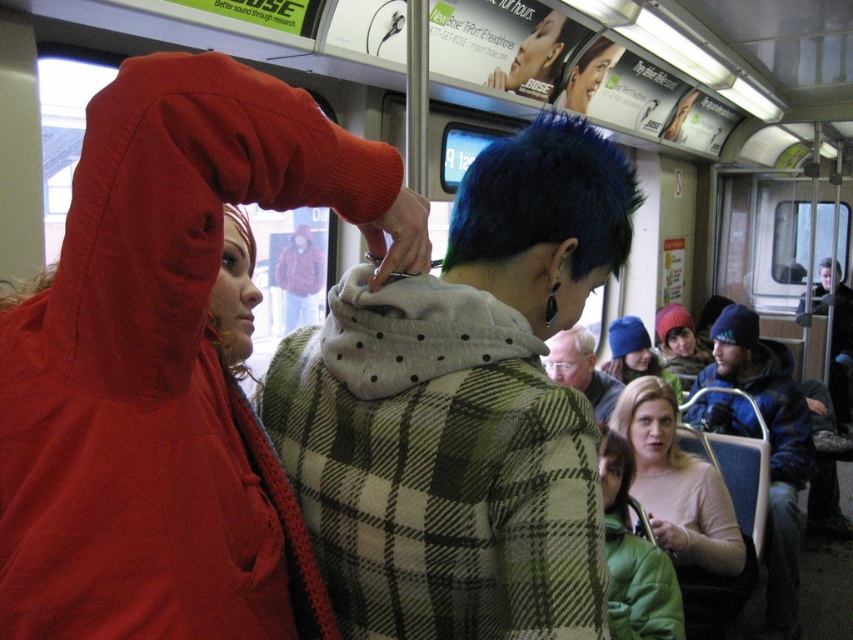
Question: Among these objects, which one is farthest from the camera?

Choices:
 (A) polka dot hoodie at center
 (B) dark blue knit cap at upper right

Answer: (B)

Question: Is matte red jacket at left wider than light pink fabric at lower right?

Choices:
 (A) no
 (B) yes

Answer: (A)

Question: Observing the image, what is the correct spatial positioning of light pink fabric at lower right in reference to blue knit cap at upper right?

Choices:
 (A) left
 (B) right

Answer: (A)

Question: Can you confirm if light pink fabric at lower right is bigger than short dark hair at center?

Choices:
 (A) yes
 (B) no

Answer: (A)

Question: Among these points, which one is farthest from the camera?

Choices:
 (A) (300, 253)
 (B) (608, 602)
 (C) (840, 332)

Answer: (C)

Question: Which point is farther to the camera?

Choices:
 (A) (786, 429)
 (B) (602, 436)
 (C) (498, 237)

Answer: (A)